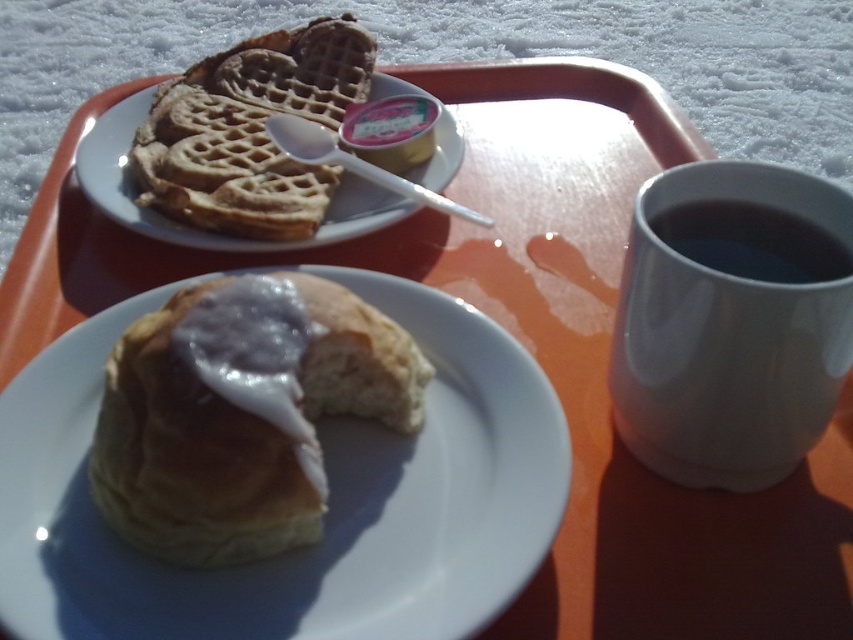
Which of these two, glazed doughnut at lower left or black matte mug at right, stands shorter?

black matte mug at right

Does point (206, 563) lie behind point (833, 269)?

No, (206, 563) is closer to viewer.

Which is in front, point (306, 506) or point (653, 220)?

Point (306, 506) is in front.

Where is `glazed doughnut at lower left`? This screenshot has height=640, width=853. glazed doughnut at lower left is located at coordinates (241, 412).

Who is lower down, glazed doughnut at lower left or golden brown waffle at upper left?

glazed doughnut at lower left

What are the coordinates of `glazed doughnut at lower left` in the screenshot? It's located at 241,412.

I want to click on glazed doughnut at lower left, so click(241, 412).

Can you confirm if glazed pastry at center is positioned above white glossy mug at upper right?

Actually, glazed pastry at center is below white glossy mug at upper right.

Between glazed pastry at center and white glossy mug at upper right, which one appears on the left side from the viewer's perspective?

From the viewer's perspective, glazed pastry at center appears more on the left side.

Between point (318, 556) and point (643, 211), which one is positioned in front?

Point (318, 556) is more forward.

The image size is (853, 640). Find the location of `glazed pastry at center`. glazed pastry at center is located at coordinates (328, 502).